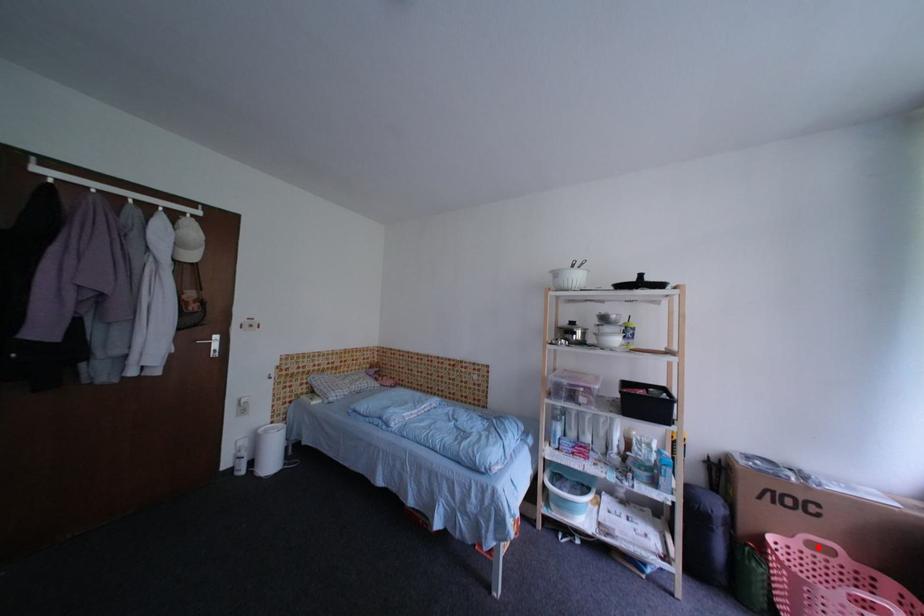
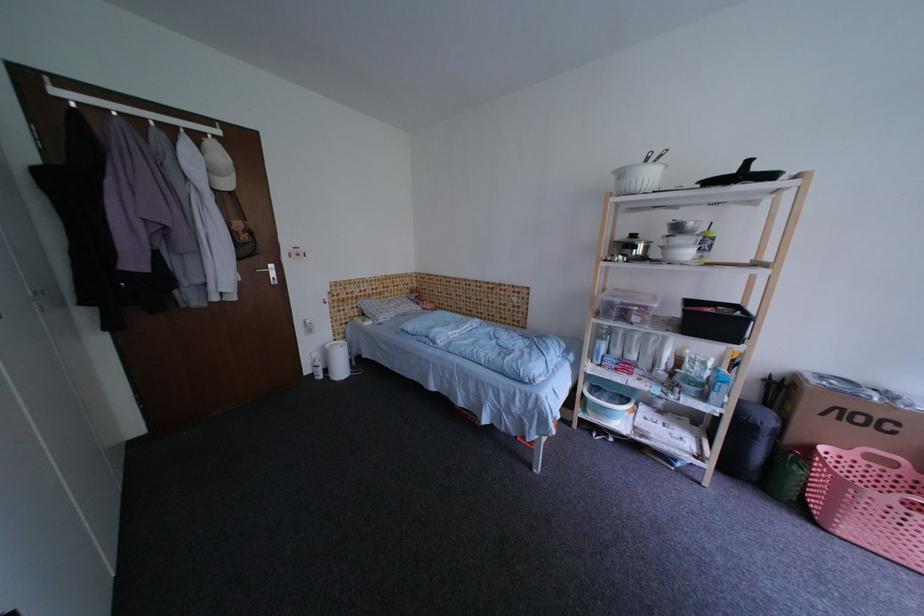
Question: I am providing you with two images of the same scene from different viewpoints. A red point is marked on the first image. Can you still see the location of the red point in image 2?

Choices:
 (A) Yes
 (B) No

Answer: (A)